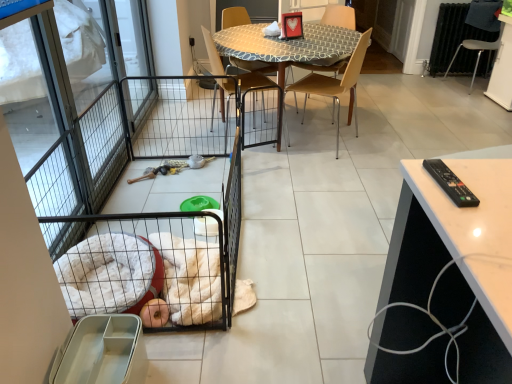
Identify the location of free area in between white glossy table at right and black wire pet cage at left. (317, 245).